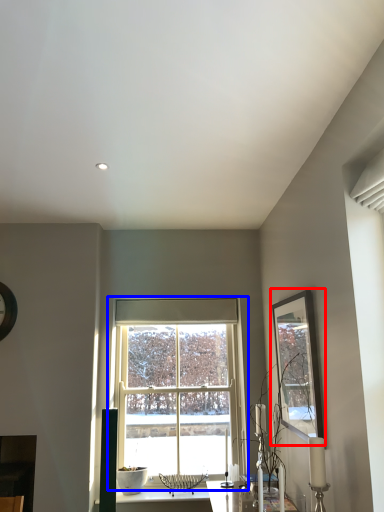
Question: Which object is further to the camera taking this photo, picture frame (highlighted by a red box) or window (highlighted by a blue box)?

Choices:
 (A) picture frame
 (B) window

Answer: (B)